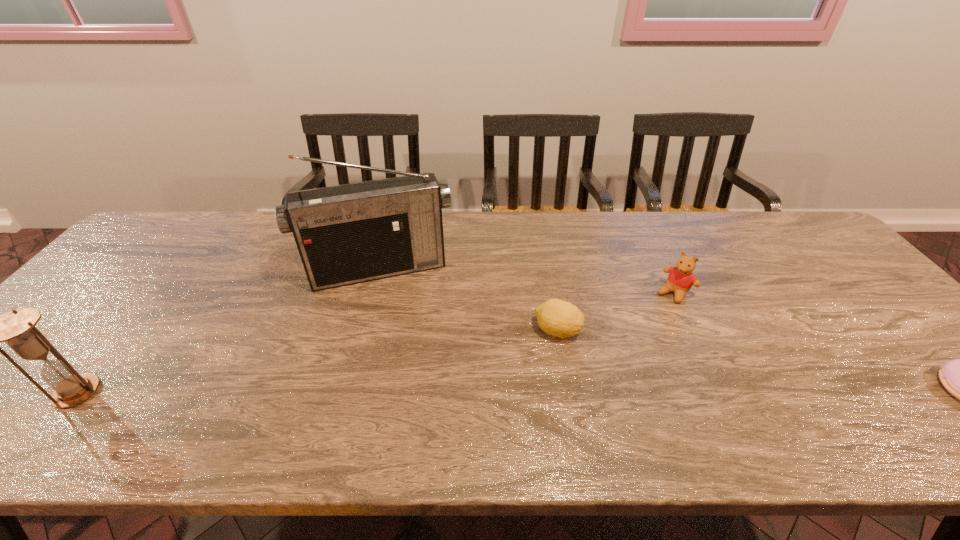
Locate an element on the screen. vacant space located 0.070m on the front-facing side of the teddy bear is located at coordinates (654, 315).

Find the location of a particular element. The image size is (960, 540). free region located 0.120m on the front-facing side of the teddy bear is located at coordinates (644, 326).

Find the location of a particular element. blank space located at the stem end of the third nearest object is located at coordinates (648, 394).

Locate an element on the screen. The image size is (960, 540). vacant point located at the stem end of the third nearest object is located at coordinates (636, 386).

Find the location of a particular element. free space located 0.230m at the stem end of the third nearest object is located at coordinates (660, 403).

The image size is (960, 540). I want to click on vacant space located 0.270m on the front-facing side of the radio receiver, so click(415, 369).

You are a GUI agent. You are given a task and a screenshot of the screen. Output one action in this format:
    pyautogui.click(x=<x>, y=<y>)
    Task: Click on the vacant space located on the front-facing side of the radio receiver
    
    Given the screenshot: What is the action you would take?
    click(x=408, y=341)

Image resolution: width=960 pixels, height=540 pixels. I want to click on vacant space located on the front-facing side of the radio receiver, so click(408, 344).

The image size is (960, 540). Find the location of `object situated at the far edge`. object situated at the far edge is located at coordinates (346, 234).

What are the coordinates of `object that is positioned at the near edge` in the screenshot? It's located at coord(17,328).